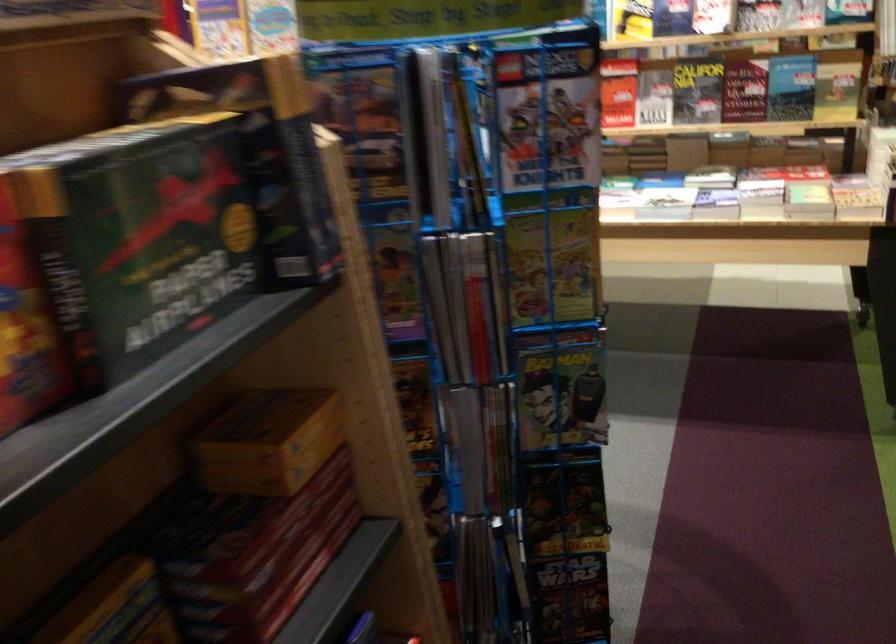
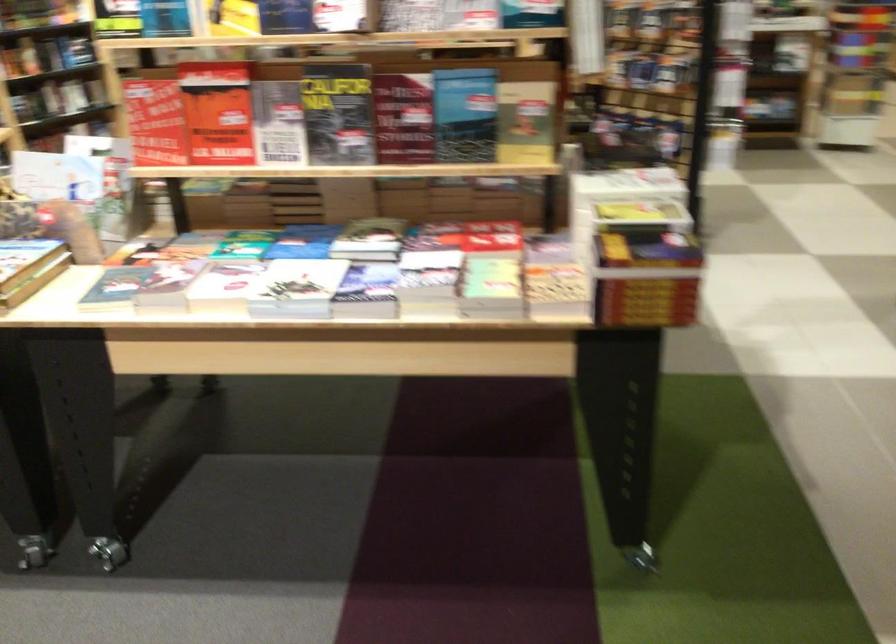
Which direction would the cameraman need to move to produce the second image?

The cameraman moved toward right, forward.